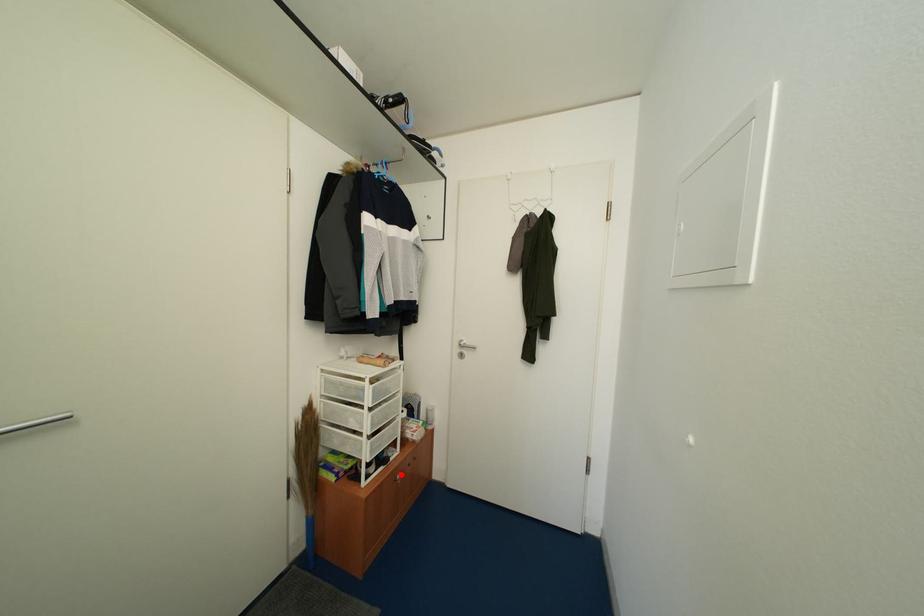
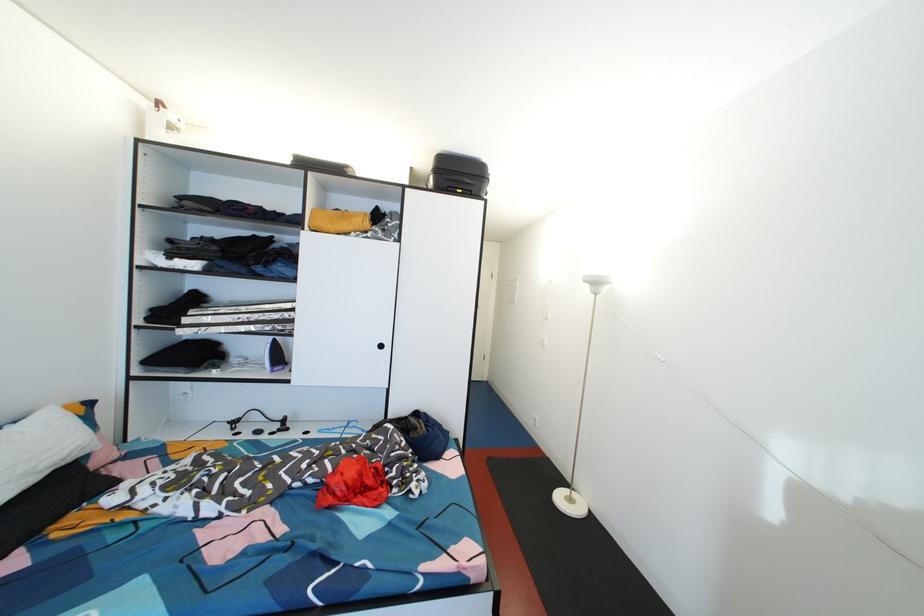
Question: I am providing you with two images of the same scene from different viewpoints. A red point is marked on the first image. Is the red point's position out of view in image 2?

Choices:
 (A) Yes
 (B) No

Answer: (A)